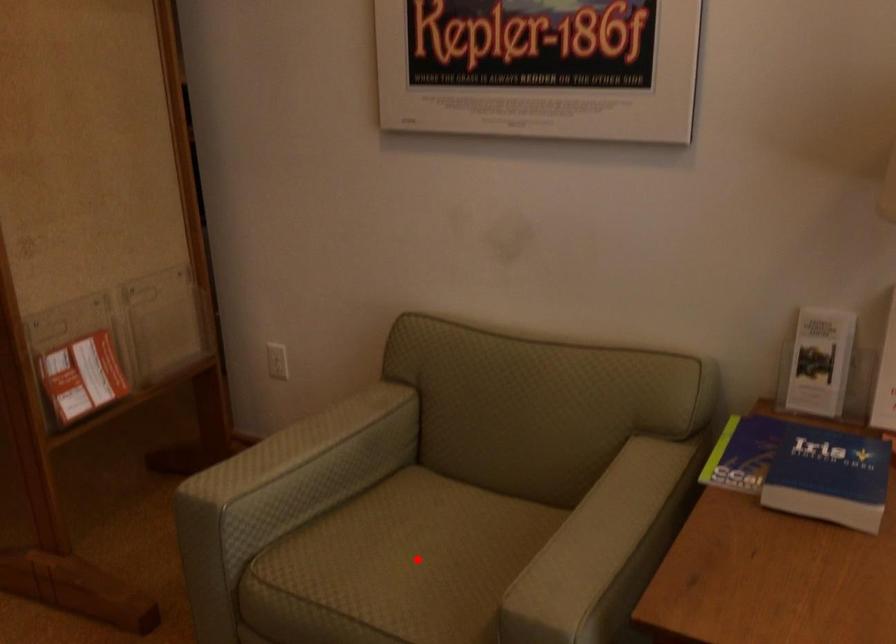
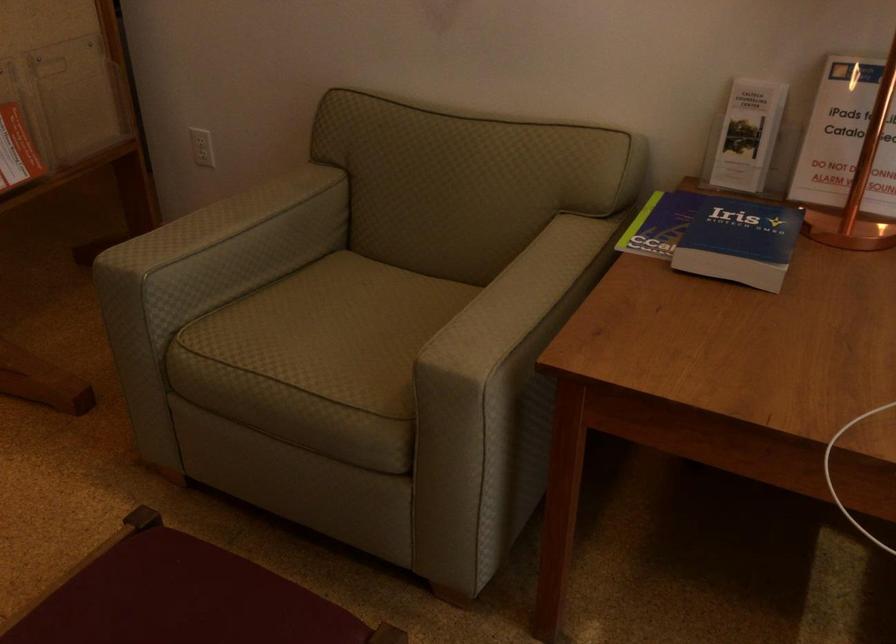
In the second image, find the point that corresponds to the highlighted location in the first image.

(343, 325)